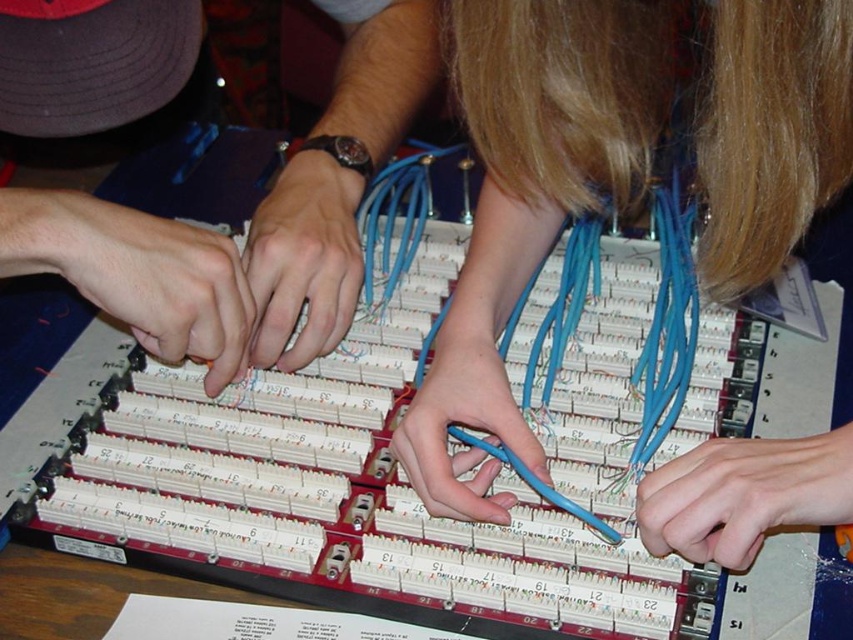
You are an engineer observing the assembly process. You notice the blue rubber gloves at center and the matte black hand at left. Which object is closer to you in the image?

The blue rubber gloves at center are closer to you because they are in front of the matte black hand at left.

You are an engineer who needs to handle the blue rubber gloves at center. Where exactly are they located in the image?

The blue rubber gloves at center are located at point (531, 202).

You are an engineer inspecting an electronic assembly. You notice the blue rubber gloves at center and the matte black hands at center. Which object occupies a larger vertical space in the image?

The blue rubber gloves at center has a greater height compared to the matte black hands at center, so the blue rubber gloves at center occupies a larger vertical space.